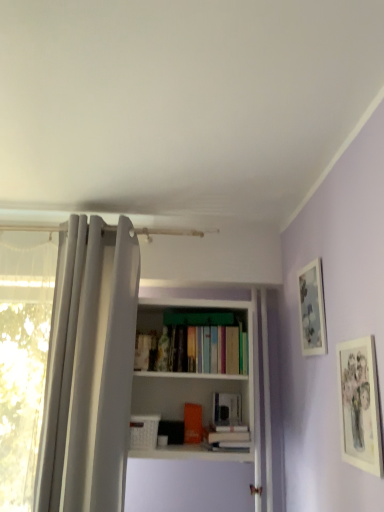
Question: Considering the relative positions of hardcover book at center, marked as the 2th book in a left-to-right arrangement, and matte silver picture frame at upper right, which is the first picture frame from back to front, in the image provided, is hardcover book at center, marked as the 2th book in a left-to-right arrangement, in front of matte silver picture frame at upper right, which is the first picture frame from back to front,?

Choices:
 (A) no
 (B) yes

Answer: (A)

Question: Can you confirm if hardcover book at center, placed as the 1th book when sorted from right to left, is smaller than matte silver picture frame at upper right, the second picture frame when ordered from front to back?

Choices:
 (A) no
 (B) yes

Answer: (A)

Question: Would you say matte silver picture frame at upper right, the second picture frame when ordered from front to back, is part of hardcover book at center, marked as the 2th book in a left-to-right arrangement,'s contents?

Choices:
 (A) no
 (B) yes

Answer: (A)

Question: Is hardcover book at center, placed as the 1th book when sorted from right to left, oriented towards matte silver picture frame at upper right, which is the first picture frame from back to front?

Choices:
 (A) no
 (B) yes

Answer: (A)

Question: From a real-world perspective, does hardcover book at center, placed as the 1th book when sorted from right to left, sit lower than matte silver picture frame at upper right, the second picture frame when ordered from front to back?

Choices:
 (A) yes
 (B) no

Answer: (A)

Question: Visually, is matte silver picture frame at upper right, which is the first picture frame from back to front, positioned to the left or to the right of white matte bookshelf at center?

Choices:
 (A) right
 (B) left

Answer: (A)

Question: From the image's perspective, is matte silver picture frame at upper right, which is the first picture frame from back to front, located above or below white matte bookshelf at center?

Choices:
 (A) above
 (B) below

Answer: (A)

Question: In terms of height, does matte silver picture frame at upper right, which is the first picture frame from back to front, look taller or shorter compared to white matte bookshelf at center?

Choices:
 (A) short
 (B) tall

Answer: (A)

Question: Considering their positions, is matte silver picture frame at upper right, the second picture frame when ordered from front to back, located in front of or behind white matte bookshelf at center?

Choices:
 (A) behind
 (B) front

Answer: (B)

Question: Is matte paper picture frame at right, the first picture frame viewed from the front, to the left or to the right of hardcover book at center, placed as the 1th book when sorted from right to left, in the image?

Choices:
 (A) left
 (B) right

Answer: (B)

Question: Relative to hardcover book at center, placed as the 1th book when sorted from right to left, is matte paper picture frame at right, which is counted as the second picture frame, starting from the back, in front or behind?

Choices:
 (A) behind
 (B) front

Answer: (B)

Question: From a real-world perspective, is matte paper picture frame at right, which is counted as the second picture frame, starting from the back, physically located above or below hardcover book at center, marked as the 2th book in a left-to-right arrangement?

Choices:
 (A) below
 (B) above

Answer: (B)

Question: Do you think matte paper picture frame at right, the first picture frame viewed from the front, is within hardcover book at center, marked as the 2th book in a left-to-right arrangement, or outside of it?

Choices:
 (A) inside
 (B) outside

Answer: (B)

Question: Is point (337, 374) closer or farther from the camera than point (162, 296)?

Choices:
 (A) farther
 (B) closer

Answer: (B)

Question: From a real-world perspective, relative to white matte bookshelf at center, is matte paper picture frame at right, which is counted as the second picture frame, starting from the back, vertically above or below?

Choices:
 (A) below
 (B) above

Answer: (A)